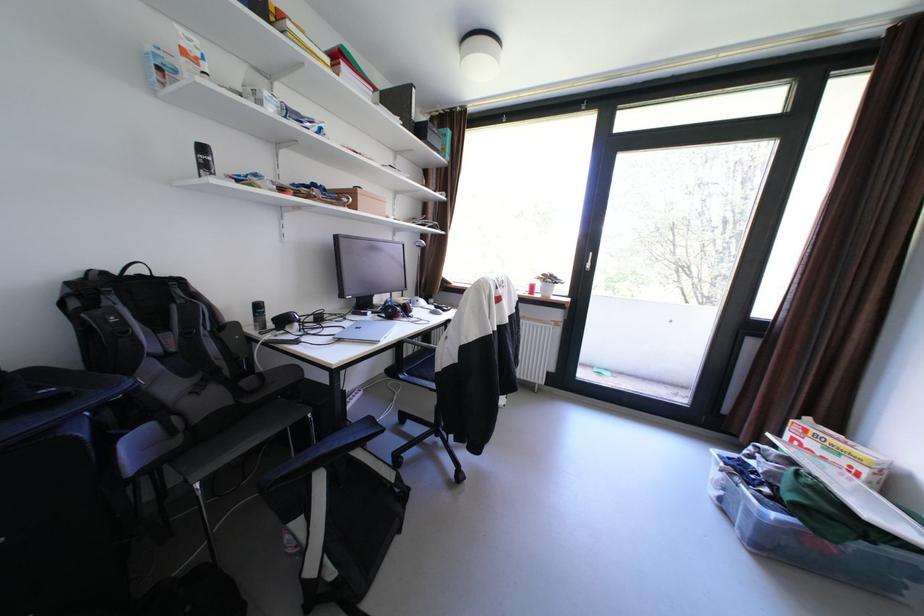
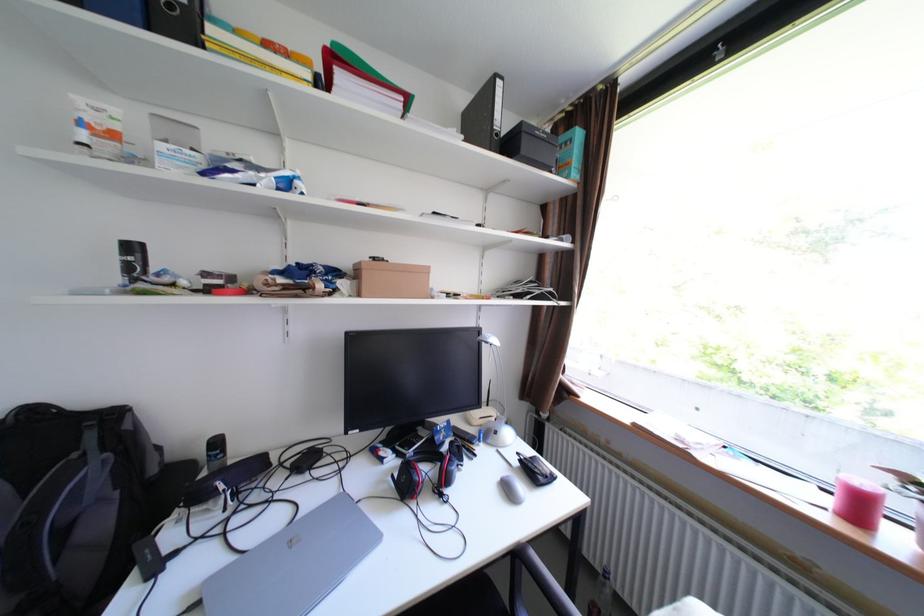
Locate, in the second image, the point that corresponds to point 355,67 in the first image.

(351, 76)